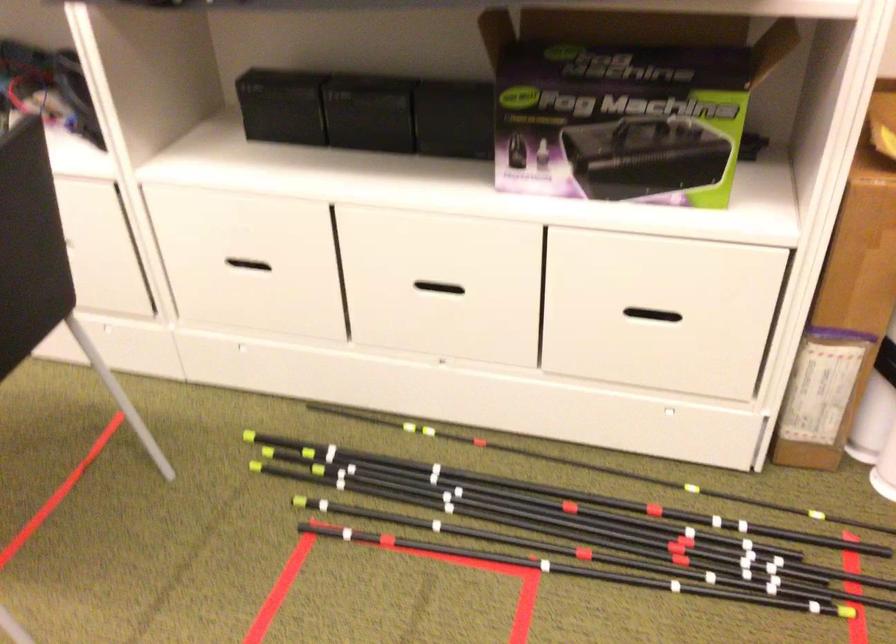
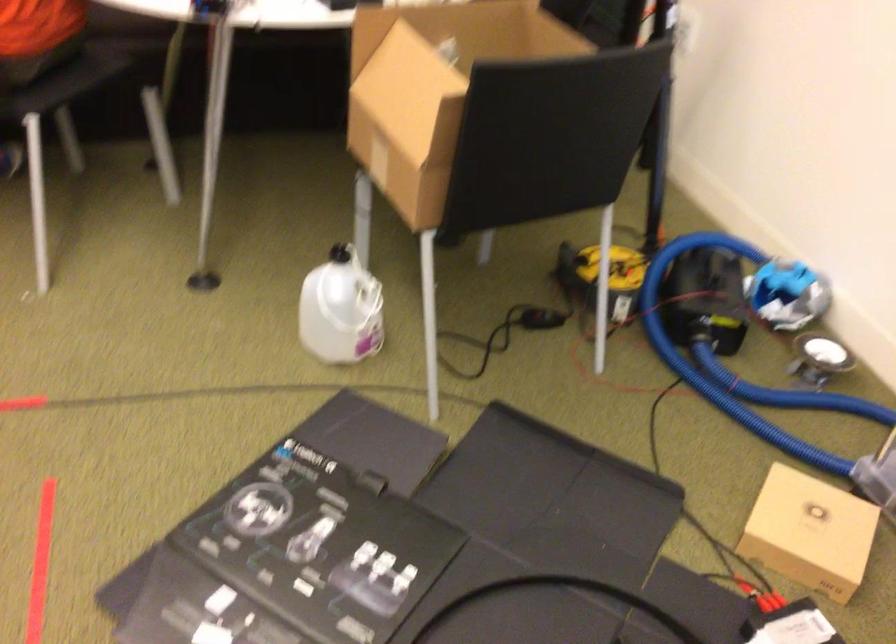
First-person continuous shooting, in which direction is the camera rotating?

The camera rotated toward right-down.